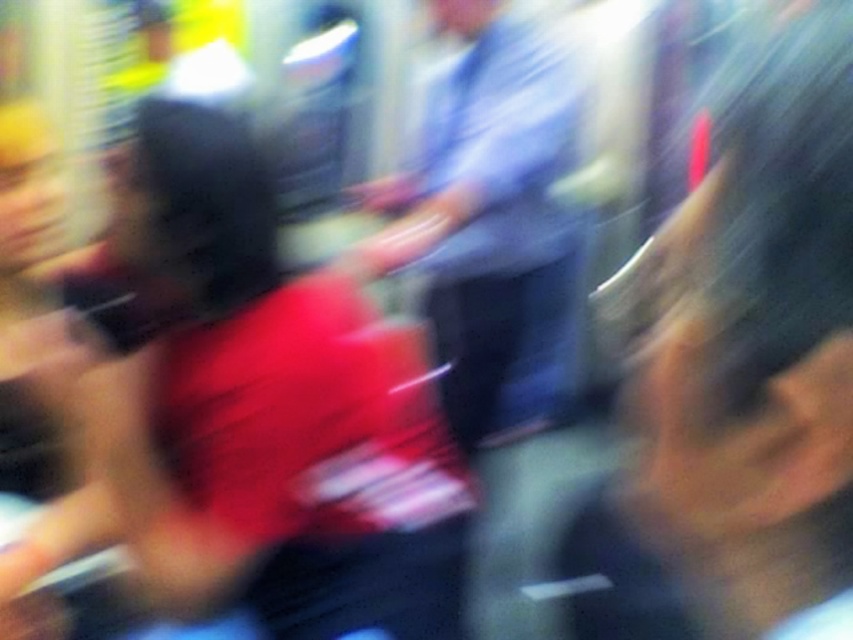
Question: Which object is closer to the camera taking this photo?

Choices:
 (A) light blue shirt at center
 (B) matte red shirt at center

Answer: (B)

Question: Which point is farther to the camera?

Choices:
 (A) (515, 33)
 (B) (351, 500)

Answer: (A)

Question: Does matte red shirt at center have a larger size compared to light blue shirt at center?

Choices:
 (A) yes
 (B) no

Answer: (B)

Question: Can you confirm if matte red shirt at center is wider than light blue shirt at center?

Choices:
 (A) yes
 (B) no

Answer: (B)

Question: Does matte red shirt at center appear on the right side of light blue shirt at center?

Choices:
 (A) yes
 (B) no

Answer: (B)